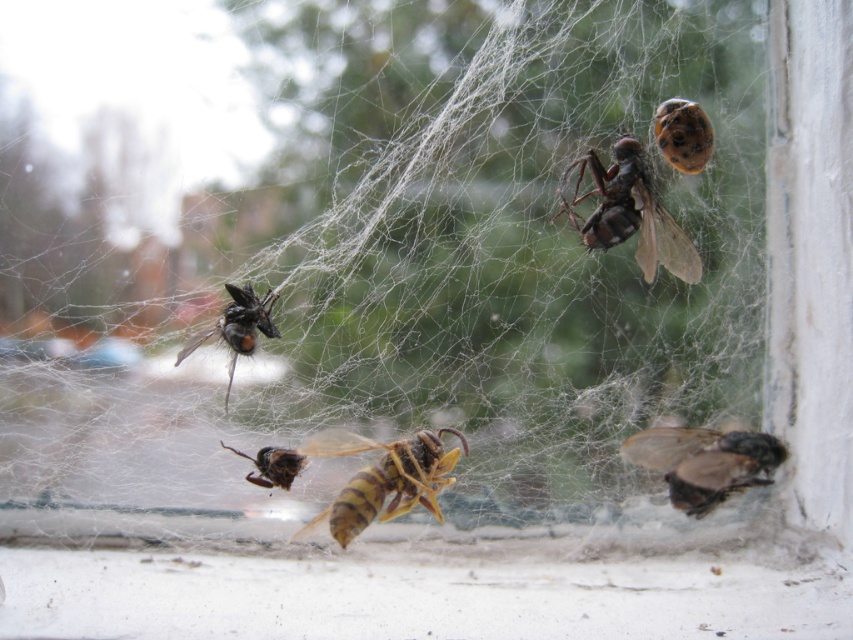
Question: Which object appears farthest from the camera in this image?

Choices:
 (A) brown fuzzy bee at lower right
 (B) shiny black fly at left

Answer: (B)

Question: Estimate the real-world distances between objects in this image. Which object is closer to the yellow striped wasp at center?

Choices:
 (A) brown fuzzy bee at upper right
 (B) brown fuzzy bee at center

Answer: (B)

Question: Does brown fuzzy bee at lower right have a larger size compared to shiny black fly at left?

Choices:
 (A) yes
 (B) no

Answer: (A)

Question: Which point is farther from the camera taking this photo?

Choices:
 (A) (637, 205)
 (B) (704, 145)
 (C) (264, 305)
 (D) (756, 456)

Answer: (C)

Question: Is shiny black fly at left positioned behind brown fuzzy bee at center?

Choices:
 (A) no
 (B) yes

Answer: (A)

Question: Is yellow striped wasp at center bigger than shiny black fly at left?

Choices:
 (A) yes
 (B) no

Answer: (A)